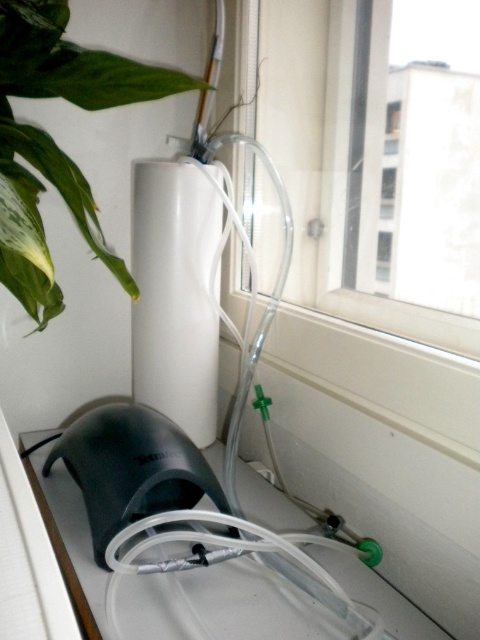
You are standing in the room and want to reach the green leafy plant at upper left to water it. The water bottle in your hand is 12 inches long. Can you water it without moving closer?

The green leafy plant at upper left is 19.01 inches from the viewer. Since the water bottle is only 12 inches long, you cannot reach it without moving closer.

You are setting up an aquarium filtration system in the room. You have a transparent glass window at upper right and a black matte mouse at lower left. Which object is taller?

The transparent glass window at upper right is taller than the black matte mouse at lower left according to the description.

You are a technician inspecting the water filtration system. You notice a green leafy plant at upper left and a black matte mouse at lower left. Which object is positioned higher in the image?

The green leafy plant at upper left is positioned higher in the image than the black matte mouse at lower left.